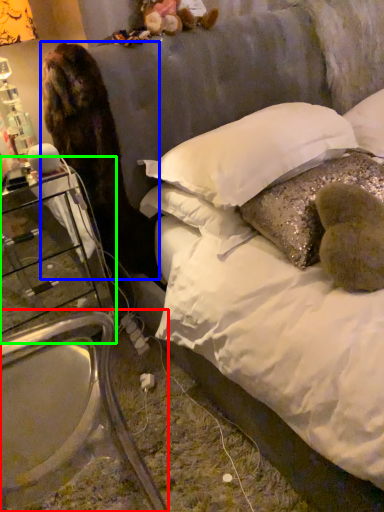
Question: Which object is the closest to the armchair (highlighted by a red box)? Choose among these: animal (highlighted by a blue box) or nightstand (highlighted by a green box).

Choices:
 (A) animal
 (B) nightstand

Answer: (B)